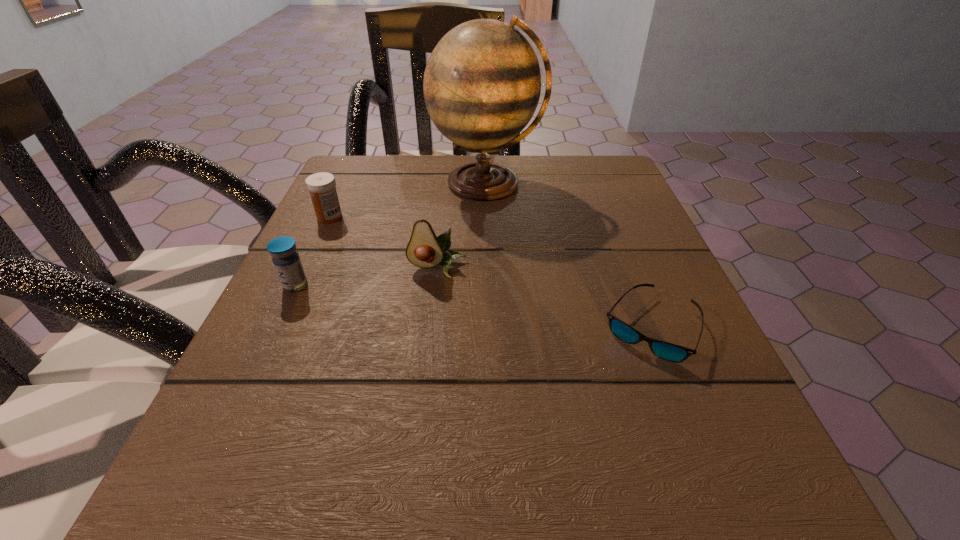
Point out which object is positioned as the third nearest to the sunglasses. Please provide its 2D coordinates. Your answer should be formatted as a tuple, i.e. [(x, y)], where the tuple contains the x and y coordinates of a point satisfying the conditions above.

[(286, 260)]

The height and width of the screenshot is (540, 960). In order to click on object that can be found as the closest to the farther medicine in this screenshot , I will do pyautogui.click(x=286, y=260).